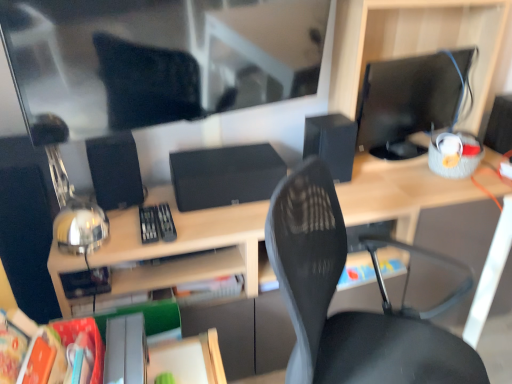
Describe the element at coordinates (209, 289) in the screenshot. I see `hardcover book at center, positioned as the second paperback book in left-to-right order` at that location.

Describe the element at coordinates (44, 359) in the screenshot. I see `orange matte paper at lower left, the 1th paperback book positioned from the front` at that location.

In order to face orange matte paper at lower left, the first paperback book viewed from the left, should I rotate leftwards or rightwards?

Rotate left and turn 27.290 degrees.

Image resolution: width=512 pixels, height=384 pixels. In order to click on wooden desk at center in this screenshot , I will do `click(188, 233)`.

How much space does black matte speaker at left, which is counted as the 1th speaker, starting from the left, occupy horizontally?

23.82 centimeters.

Image resolution: width=512 pixels, height=384 pixels. Identify the location of matte blue book at center. (356, 276).

Where is `black mesh chair at center`? Image resolution: width=512 pixels, height=384 pixels. black mesh chair at center is located at coordinates (350, 311).

Locate an element on the screen. Image resolution: width=512 pixels, height=384 pixels. hardcover book at center, positioned as the second paperback book in left-to-right order is located at coordinates (209, 289).

How many degrees apart are the facing directions of wooden desk at center and black matte speaker at left, the third speaker positioned from the right?

5.38 degrees separate the facing orientations of wooden desk at center and black matte speaker at left, the third speaker positioned from the right.

Find the location of a particular element. The width and height of the screenshot is (512, 384). the 3rd speaker located above the wooden desk at center (from a real-world perspective) is located at coordinates (115, 171).

How far apart are wooden desk at center and black matte speaker at left, the third speaker positioned from the right?

6.87 inches.

Does wooden desk at center have a greater width compared to black matte speaker at left, the third speaker positioned from the right?

Correct, the width of wooden desk at center exceeds that of black matte speaker at left, the third speaker positioned from the right.

Which is behind, point (362, 109) or point (368, 281)?

Point (368, 281)

Considering the relative sizes of matte black monitor at right and matte blue book at center in the image provided, is matte black monitor at right wider than matte blue book at center?

Correct, the width of matte black monitor at right exceeds that of matte blue book at center.

How many degrees apart are the facing directions of matte black monitor at right and matte blue book at center?

matte black monitor at right and matte blue book at center are facing 13.9 degrees away from each other.

Image resolution: width=512 pixels, height=384 pixels. Identify the location of book that appears on the right of orange matte paper at lower left, the 2th paperback book when ordered from right to left. (356, 276).

Is orange matte paper at lower left, the 1th paperback book positioned from the front, aimed at matte blue book at center?

No, orange matte paper at lower left, the 1th paperback book positioned from the front, does not turn towards matte blue book at center.

Could you measure the distance between orange matte paper at lower left, which ranks as the second paperback book in back-to-front order, and matte blue book at center?

orange matte paper at lower left, which ranks as the second paperback book in back-to-front order, and matte blue book at center are 3.41 feet apart from each other.

Can you confirm if black matte speaker at right, acting as the 1th speaker starting from the right, is wider than black mesh chair at center?

No.

Between black matte speaker at right, acting as the 1th speaker starting from the right, and black mesh chair at center, which one has larger size?

black mesh chair at center.

Between point (509, 144) and point (289, 308), which one is positioned in front?

The point (289, 308) is closer to the camera.

Considering the positions of objects black matte speaker at right, positioned as the 3th speaker in left-to-right order, and black mesh chair at center in the image provided, who is more to the left, black matte speaker at right, positioned as the 3th speaker in left-to-right order, or black mesh chair at center?

Positioned to the left is black mesh chair at center.

Which point is more distant from viewer, (35, 370) or (487, 144)?

Point (487, 144)

Measure the distance from orange matte paper at lower left, which ranks as the second paperback book in back-to-front order, to black matte speaker at right, acting as the 1th speaker starting from the right.

orange matte paper at lower left, which ranks as the second paperback book in back-to-front order, and black matte speaker at right, acting as the 1th speaker starting from the right, are 1.70 meters apart from each other.

Between orange matte paper at lower left, the first paperback book viewed from the left, and black matte speaker at right, positioned as the 3th speaker in left-to-right order, which one has smaller width?

orange matte paper at lower left, the first paperback book viewed from the left.

Is orange matte paper at lower left, the first paperback book viewed from the left, facing away from black matte speaker at right, positioned as the 3th speaker in left-to-right order?

No, orange matte paper at lower left, the first paperback book viewed from the left, is not facing away from black matte speaker at right, positioned as the 3th speaker in left-to-right order.

From their relative heights in the image, would you say matte blue book at center is taller or shorter than orange matte paper at lower left, which ranks as the second paperback book in back-to-front order?

Clearly, matte blue book at center is shorter compared to orange matte paper at lower left, which ranks as the second paperback book in back-to-front order.

How much distance is there between matte blue book at center and orange matte paper at lower left, the 1th paperback book positioned from the front?

matte blue book at center is 3.41 feet from orange matte paper at lower left, the 1th paperback book positioned from the front.

Is orange matte paper at lower left, the first paperback book viewed from the left, located within matte blue book at center?

That's incorrect, orange matte paper at lower left, the first paperback book viewed from the left, is not inside matte blue book at center.

From a real-world perspective, is matte blue book at center positioned under orange matte paper at lower left, the 2th paperback book when ordered from right to left, based on gravity?

Indeed, from a real-world perspective, matte blue book at center is positioned beneath orange matte paper at lower left, the 2th paperback book when ordered from right to left.

Looking at their sizes, would you say wooden desk at center is wider or thinner than hardcover book at center, positioned as the second paperback book in left-to-right order?

In the image, wooden desk at center appears to be wider than hardcover book at center, positioned as the second paperback book in left-to-right order.

Between wooden desk at center and hardcover book at center, positioned as the second paperback book in left-to-right order, which one has larger size?

With larger size is wooden desk at center.

Which of these two, wooden desk at center or hardcover book at center, the first paperback book positioned from the right, stands taller?

Standing taller between the two is wooden desk at center.

How much distance is there between wooden desk at center and hardcover book at center, marked as the second paperback book in a front-to-back arrangement?

A distance of 6.32 inches exists between wooden desk at center and hardcover book at center, marked as the second paperback book in a front-to-back arrangement.

Find the location of a particular element. The image size is (512, 384). desk directly beneath the black matte speaker at left, which is counted as the 1th speaker, starting from the left (from a real-world perspective) is located at coordinates (188, 233).

This screenshot has height=384, width=512. Find the location of `book lying below the matte black monitor at right (from the image's perspective)`. book lying below the matte black monitor at right (from the image's perspective) is located at coordinates (356, 276).

Considering their positions, is hardcover book at center, the 1th paperback book viewed from the back, positioned closer to black matte speaker at right, positioned as the 3th speaker in left-to-right order, than black matte speaker at left, the third speaker positioned from the right?

Based on the image, hardcover book at center, the 1th paperback book viewed from the back, appears to be nearer to black matte speaker at right, positioned as the 3th speaker in left-to-right order.

Estimate the real-world distances between objects in this image. Which object is closer to orange matte paper at lower left, the 2th paperback book when ordered from right to left, matte blue book at center or black matte speaker at left, the third speaker positioned from the right?

black matte speaker at left, the third speaker positioned from the right, is positioned closer to the anchor orange matte paper at lower left, the 2th paperback book when ordered from right to left.

Looking at the image, which one is located further to matte blue book at center, black mesh chair at center or black matte speaker at left, the third speaker positioned from the right?

Based on the image, black matte speaker at left, the third speaker positioned from the right, appears to be further to matte blue book at center.

From the image, which object appears to be farther from black matte speaker at center, which ranks as the second speaker in left-to-right order, black mesh chair at center or black matte speaker at left, the third speaker positioned from the right?

Among the two, black matte speaker at left, the third speaker positioned from the right, is located further to black matte speaker at center, which ranks as the second speaker in left-to-right order.

Looking at this image, from the image, which object appears to be farther from orange matte paper at lower left, the first paperback book viewed from the left, black matte speaker at center, the second speaker in the right-to-left sequence, or black matte speaker at right, positioned as the 3th speaker in left-to-right order?

Based on the image, black matte speaker at right, positioned as the 3th speaker in left-to-right order, appears to be further to orange matte paper at lower left, the first paperback book viewed from the left.

Which object lies nearer to the anchor point orange matte paper at lower left, the first paperback book viewed from the left, matte blue book at center or black matte speaker at center, the second speaker in the right-to-left sequence?

matte blue book at center lies closer to orange matte paper at lower left, the first paperback book viewed from the left, than the other object.

Estimate the real-world distances between objects in this image. Which object is further from wooden desk at center, matte blue book at center or black matte speaker at center, which ranks as the second speaker in left-to-right order?

matte blue book at center.

Based on their spatial positions, is black matte speaker at right, positioned as the 3th speaker in left-to-right order, or matte black monitor at right further from matte blue book at center?

Among the two, black matte speaker at right, positioned as the 3th speaker in left-to-right order, is located further to matte blue book at center.

Locate an element on the screen. The width and height of the screenshot is (512, 384). paperback book between orange matte paper at lower left, which ranks as the second paperback book in back-to-front order, and black matte speaker at center, which ranks as the second speaker in left-to-right order, from left to right is located at coordinates (209, 289).

Where is `computer monitor between wooden desk at center and black matte speaker at right, positioned as the 3th speaker in left-to-right order, in the horizontal direction`? computer monitor between wooden desk at center and black matte speaker at right, positioned as the 3th speaker in left-to-right order, in the horizontal direction is located at coordinates (410, 100).

Image resolution: width=512 pixels, height=384 pixels. Identify the location of book between hardcover book at center, positioned as the second paperback book in left-to-right order, and black matte speaker at right, positioned as the 3th speaker in left-to-right order, from left to right. (356, 276).

What are the coordinates of `computer monitor between black matte speaker at left, the third speaker positioned from the right, and black matte speaker at right, acting as the 1th speaker starting from the right` in the screenshot? It's located at (410, 100).